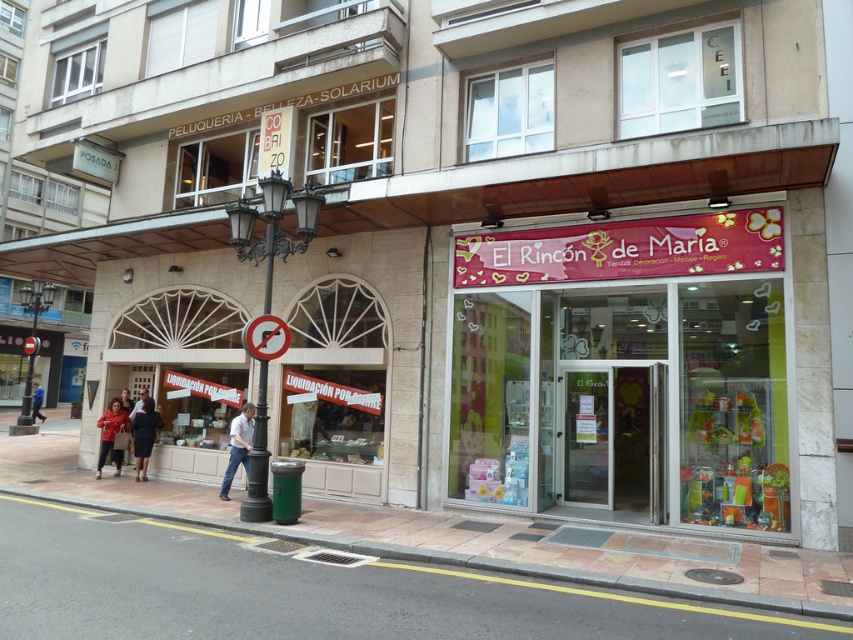
Question: In this image, where is pink fabric sign at center located relative to blue fabric pants at center?

Choices:
 (A) above
 (B) below

Answer: (A)

Question: Which is farther from the pink fabric sign at center?

Choices:
 (A) smooth concrete pavement at lower center
 (B) blue fabric pants at center
 (C) matte red coat at center

Answer: (B)

Question: Where is smooth concrete pavement at lower center located in relation to dark blue fabric coat at center in the image?

Choices:
 (A) right
 (B) left

Answer: (A)

Question: Which point is closer to the camera taking this photo?

Choices:
 (A) (109, 451)
 (B) (219, 493)

Answer: (B)

Question: Observing the image, what is the correct spatial positioning of light blue jeans at center in reference to matte red coat at center?

Choices:
 (A) above
 (B) below

Answer: (A)

Question: Which object is positioned farthest from the light blue jeans at center?

Choices:
 (A) dark blue fabric coat at center
 (B) pink fabric sign at center
 (C) smooth concrete pavement at lower center

Answer: (B)